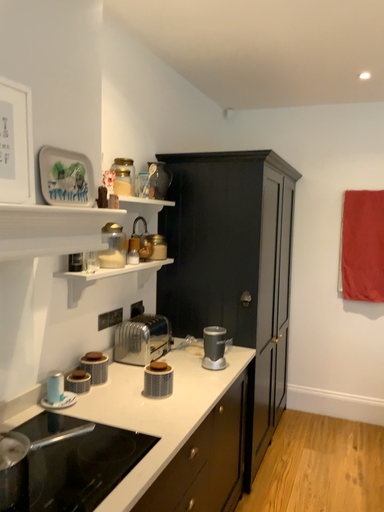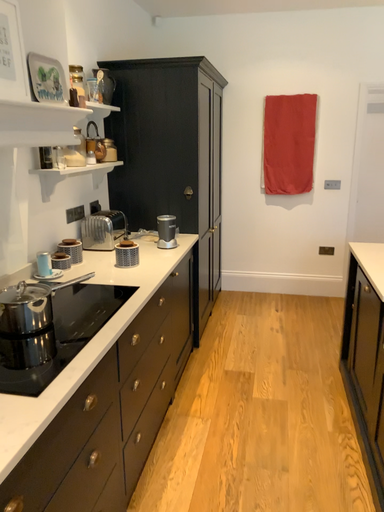
Question: How did the camera likely rotate when shooting the video?

Choices:
 (A) rotated downward
 (B) rotated upward

Answer: (A)